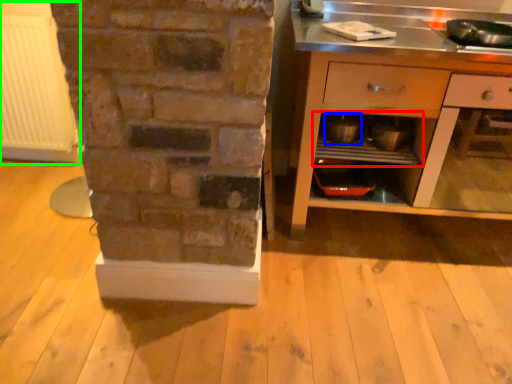
Question: Which is farther away from shelf (highlighted by a red box)? appliance (highlighted by a blue box) or radiator (highlighted by a green box)?

Choices:
 (A) appliance
 (B) radiator

Answer: (B)